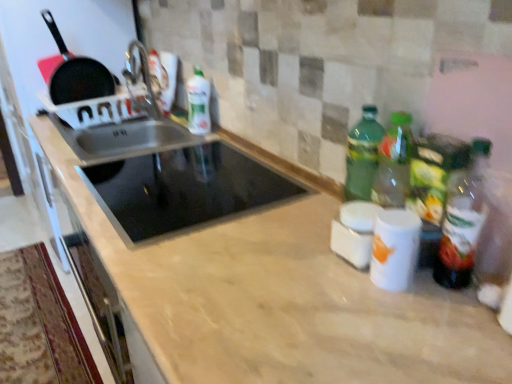
The height and width of the screenshot is (384, 512). What are the coordinates of `green glass bottle at right, acting as the 1th bottle starting from the bottom` in the screenshot? It's located at (462, 221).

What do you see at coordinates (462, 221) in the screenshot?
I see `green glass bottle at right, the second bottle when ordered from back to front` at bounding box center [462, 221].

The image size is (512, 384). In order to click on black matte frying pan at upper left in this screenshot , I will do tap(77, 73).

Locate an element on the screen. The width and height of the screenshot is (512, 384). black glass cooktop at center is located at coordinates (183, 189).

Identify the location of green matte bottle at upper center, acting as the 2th bottle starting from the front. The height and width of the screenshot is (384, 512). (198, 103).

The height and width of the screenshot is (384, 512). In order to click on green glass bottle at right, the second bottle in the top-to-bottom sequence in this screenshot , I will do `click(462, 221)`.

Is green glass bottle at right, acting as the 1th bottle starting from the right, taller than black glass cooktop at center?

Yes.

From a real-world perspective, between green glass bottle at right, the second bottle when ordered from back to front, and black glass cooktop at center, who is vertically higher?

From a 3D spatial view, green glass bottle at right, the second bottle when ordered from back to front, is above.

Can black glass cooktop at center be found inside green glass bottle at right, the second bottle in the top-to-bottom sequence?

No, black glass cooktop at center is not a part of green glass bottle at right, the second bottle in the top-to-bottom sequence.

From the picture: How many degrees apart are the facing directions of green glass bottle at right, acting as the 1th bottle starting from the right, and black glass cooktop at center?

The facing directions of green glass bottle at right, acting as the 1th bottle starting from the right, and black glass cooktop at center are 10 degrees apart.

Is green glass bottle at right, the second bottle in the top-to-bottom sequence, looking in the opposite direction of green matte bottle at upper center, positioned as the first bottle in left-to-right order?

No, green glass bottle at right, the second bottle in the top-to-bottom sequence,'s orientation is not away from green matte bottle at upper center, positioned as the first bottle in left-to-right order.

Considering the sizes of objects green glass bottle at right, acting as the 1th bottle starting from the bottom, and green matte bottle at upper center, which is the second bottle from bottom to top, in the image provided, who is bigger, green glass bottle at right, acting as the 1th bottle starting from the bottom, or green matte bottle at upper center, which is the second bottle from bottom to top,?

green matte bottle at upper center, which is the second bottle from bottom to top.

Is green glass bottle at right, the second bottle in the top-to-bottom sequence, wider or thinner than green matte bottle at upper center, acting as the 2th bottle starting from the front?

Clearly, green glass bottle at right, the second bottle in the top-to-bottom sequence, has less width compared to green matte bottle at upper center, acting as the 2th bottle starting from the front.

Is the depth of green glass bottle at right, the second bottle when ordered from back to front, greater than that of black matte frying pan at upper left?

No, green glass bottle at right, the second bottle when ordered from back to front, is in front of black matte frying pan at upper left.

This screenshot has width=512, height=384. Find the location of `the 2nd bottle counting from the right of the black matte frying pan at upper left`. the 2nd bottle counting from the right of the black matte frying pan at upper left is located at coordinates (462, 221).

Between green glass bottle at right, acting as the 1th bottle starting from the bottom, and black matte frying pan at upper left, which one appears on the left side from the viewer's perspective?

From the viewer's perspective, black matte frying pan at upper left appears more on the left side.

Is point (470, 270) closer or farther from the camera than point (98, 95)?

Point (470, 270) is closer to the camera than point (98, 95).

Considering the sizes of black matte frying pan at upper left and green matte bottle at upper center, which is the second bottle from bottom to top, in the image, is black matte frying pan at upper left taller or shorter than green matte bottle at upper center, which is the second bottle from bottom to top,?

Clearly, black matte frying pan at upper left is taller compared to green matte bottle at upper center, which is the second bottle from bottom to top.

Is black matte frying pan at upper left placed right next to green matte bottle at upper center, which is the second bottle from bottom to top?

No.

Is point (104, 87) closer or farther from the camera than point (205, 131)?

Point (104, 87).

Is black matte frying pan at upper left facing towards green matte bottle at upper center, the 1th bottle from the back?

No, black matte frying pan at upper left is not aimed at green matte bottle at upper center, the 1th bottle from the back.

Looking at their sizes, would you say black matte frying pan at upper left is wider or thinner than black glass cooktop at center?

black matte frying pan at upper left is thinner than black glass cooktop at center.

From the image's perspective, is black matte frying pan at upper left over black glass cooktop at center?

Yes, from the image's perspective, black matte frying pan at upper left is over black glass cooktop at center.

Is black matte frying pan at upper left far away from black glass cooktop at center?

No, black matte frying pan at upper left is not far away from black glass cooktop at center.

Is black matte frying pan at upper left spatially inside black glass cooktop at center, or outside of it?

black matte frying pan at upper left exists outside the volume of black glass cooktop at center.

This screenshot has width=512, height=384. In order to click on bottle that is the 1st one above the black glass cooktop at center (from a real-world perspective) in this screenshot , I will do `click(198, 103)`.

Based on the photo, is black glass cooktop at center inside or outside of green matte bottle at upper center, acting as the 2th bottle starting from the front?

The correct answer is: outside.

From the image's perspective, is black glass cooktop at center located above or below green matte bottle at upper center, the first bottle viewed from the top?

Based on their image positions, black glass cooktop at center is located beneath green matte bottle at upper center, the first bottle viewed from the top.

Is black glass cooktop at center in front of or behind green matte bottle at upper center, which is counted as the second bottle, starting from the right, in the image?

black glass cooktop at center is positioned closer to the viewer than green matte bottle at upper center, which is counted as the second bottle, starting from the right.

Would you say black glass cooktop at center is to the left or to the right of green glass bottle at right, acting as the 1th bottle starting from the bottom, in the picture?

black glass cooktop at center is to the left of green glass bottle at right, acting as the 1th bottle starting from the bottom.

In the scene shown: Which of these two, black glass cooktop at center or green glass bottle at right, acting as the 1th bottle starting from the right, stands taller?

green glass bottle at right, acting as the 1th bottle starting from the right.

Can you confirm if black glass cooktop at center is smaller than green glass bottle at right, the 1th bottle in the front-to-back sequence?

Actually, black glass cooktop at center might be larger than green glass bottle at right, the 1th bottle in the front-to-back sequence.

The height and width of the screenshot is (384, 512). I want to click on appliance behind the green glass bottle at right, acting as the 1th bottle starting from the right, so click(183, 189).

Locate an element on the screen. bottle below the green glass bottle at right, the 1th bottle in the front-to-back sequence (from a real-world perspective) is located at coordinates (198, 103).

Considering their positions, is black glass cooktop at center positioned further to green matte bottle at upper center, which is counted as the second bottle, starting from the right, than black matte frying pan at upper left?

The object further to green matte bottle at upper center, which is counted as the second bottle, starting from the right, is black matte frying pan at upper left.

Which object lies nearer to the anchor point black glass cooktop at center, black matte frying pan at upper left or green glass bottle at right, the second bottle in the top-to-bottom sequence?

green glass bottle at right, the second bottle in the top-to-bottom sequence, is positioned closer to the anchor black glass cooktop at center.

From the image, which object appears to be nearer to black glass cooktop at center, black matte frying pan at upper left or green matte bottle at upper center, acting as the 2th bottle starting from the front?

green matte bottle at upper center, acting as the 2th bottle starting from the front, is closer to black glass cooktop at center.

Based on the photo, when comparing their distances from green glass bottle at right, the second bottle in the top-to-bottom sequence, does black matte frying pan at upper left or black glass cooktop at center seem further?

Based on the image, black matte frying pan at upper left appears to be further to green glass bottle at right, the second bottle in the top-to-bottom sequence.

Estimate the real-world distances between objects in this image. Which object is closer to black matte frying pan at upper left, black glass cooktop at center or green glass bottle at right, the second bottle in the top-to-bottom sequence?

Based on the image, black glass cooktop at center appears to be nearer to black matte frying pan at upper left.

Looking at the image, which one is located closer to black glass cooktop at center, green matte bottle at upper center, positioned as the first bottle in left-to-right order, or black matte frying pan at upper left?

The object closer to black glass cooktop at center is green matte bottle at upper center, positioned as the first bottle in left-to-right order.

Looking at the image, which one is located further to black matte frying pan at upper left, green matte bottle at upper center, acting as the 2th bottle starting from the front, or green glass bottle at right, the 1th bottle in the front-to-back sequence?

green glass bottle at right, the 1th bottle in the front-to-back sequence, is positioned further to the anchor black matte frying pan at upper left.

Looking at this image, when comparing their distances from green glass bottle at right, the second bottle when ordered from back to front, does black matte frying pan at upper left or green matte bottle at upper center, the 1th bottle from the back, seem closer?

The object closer to green glass bottle at right, the second bottle when ordered from back to front, is green matte bottle at upper center, the 1th bottle from the back.

Find the location of a particular element. The width and height of the screenshot is (512, 384). appliance between black matte frying pan at upper left and green glass bottle at right, the second bottle positioned from the left is located at coordinates (183, 189).

Find the location of a particular element. This screenshot has width=512, height=384. bottle between black matte frying pan at upper left and green glass bottle at right, the 1th bottle in the front-to-back sequence, from left to right is located at coordinates (198, 103).

What are the coordinates of `appliance positioned between green glass bottle at right, the second bottle when ordered from back to front, and green matte bottle at upper center, which is the second bottle from bottom to top, from near to far` in the screenshot? It's located at (183, 189).

Where is `bottle between black glass cooktop at center and black matte frying pan at upper left in the front-back direction`? The height and width of the screenshot is (384, 512). bottle between black glass cooktop at center and black matte frying pan at upper left in the front-back direction is located at coordinates click(x=198, y=103).